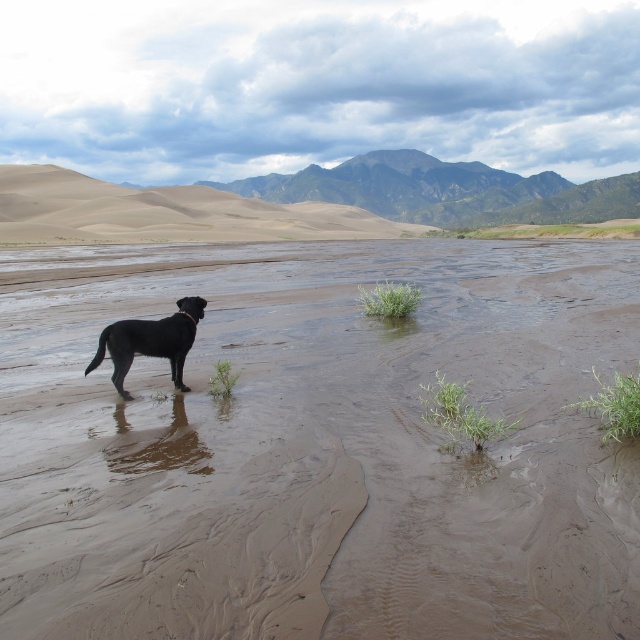
You are standing at the point closer to the camera between point (369, 257) and point (163, 326). Which point are you at?

You are at point (163, 326) because it is closer to the camera than point (369, 257).

Consider the image. You are a photographer trying to capture the black glossy dog at center and the brown sandy mud at center in the same frame. Based on their positions, which object is closer to the camera?

The brown sandy mud at center is positioned over the black glossy dog at center, indicating it is closer to the camera.